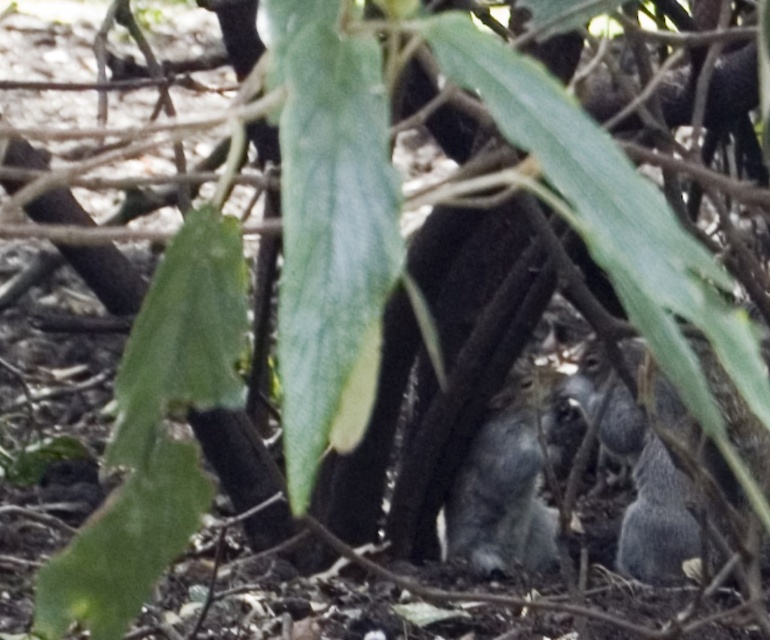
Can you confirm if gray furry squirrel at lower right is thinner than gray furry squirrel at center?

No, gray furry squirrel at lower right is not thinner than gray furry squirrel at center.

Can you confirm if gray furry squirrel at lower right is positioned below gray furry squirrel at center?

No.

Measure the distance between gray furry squirrel at lower right and camera.

gray furry squirrel at lower right and camera are 5.00 feet apart from each other.

Where is `gray furry squirrel at lower right`? gray furry squirrel at lower right is located at coordinates (648, 497).